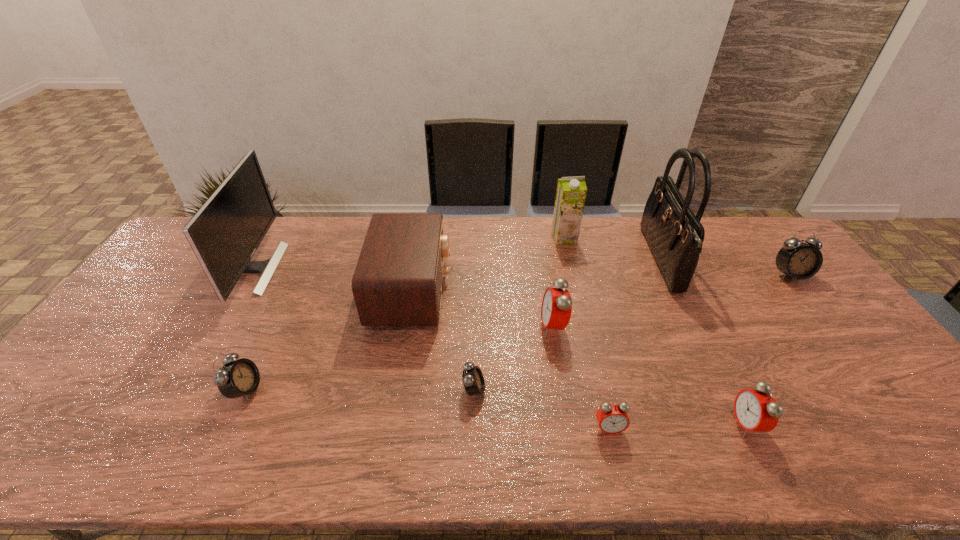
Find the location of a particular element. The image size is (960, 540). vacant space in between the second biggest white alarm clock and the fifth nearest alarm clock is located at coordinates (399, 359).

You are a GUI agent. You are given a task and a screenshot of the screen. Output one action in this format:
    pyautogui.click(x=<x>, y=<y>)
    Task: Click on the unoccupied position between the second alarm clock from right to left and the third tallest object
    
    Given the screenshot: What is the action you would take?
    pyautogui.click(x=655, y=330)

This screenshot has width=960, height=540. I want to click on free point between the monitor and the black handbag, so click(458, 264).

Locate an element on the screen. vacant point located between the seventh shortest object and the fourth alarm clock from left to right is located at coordinates (510, 360).

I want to click on object that is the eighth closest to the soya milk, so click(224, 234).

Find the location of a particular element. object that stands as the seventh closest to the green soya milk is located at coordinates (756, 410).

The width and height of the screenshot is (960, 540). I want to click on alarm clock that stands as the fifth closest to the tallest object, so click(473, 380).

The height and width of the screenshot is (540, 960). I want to click on alarm clock that stands as the closest to the leftmost red alarm clock, so tap(473, 380).

Locate which red alarm clock ranks second in proximity to the fourth alarm clock from left to right. Please provide its 2D coordinates. Your answer should be formatted as a tuple, i.e. [(x, y)], where the tuple contains the x and y coordinates of a point satisfying the conditions above.

[(756, 410)]

The height and width of the screenshot is (540, 960). Identify the location of the closest red alarm clock relative to the fifth object from left to right. (612, 418).